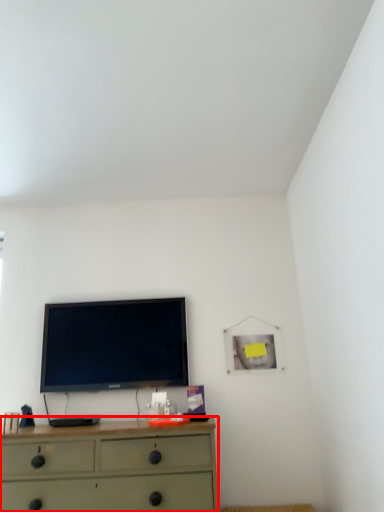
Question: From the image's perspective, where is chest of drawers (annotated by the red box) located relative to television?

Choices:
 (A) above
 (B) below

Answer: (B)